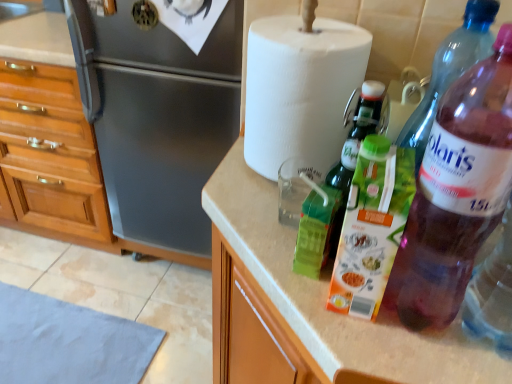
Question: Looking at their shapes, would you say beige laminate countertop at center is wider or thinner than purple translucent bottle at right, which is counted as the first bottle, starting from the back?

Choices:
 (A) wide
 (B) thin

Answer: (A)

Question: Is beige laminate countertop at center spatially inside purple translucent bottle at right, the third bottle positioned from the front, or outside of it?

Choices:
 (A) inside
 (B) outside

Answer: (B)

Question: Considering the real-world distances, which object is farthest from the brushed metal refrigerator at left?

Choices:
 (A) beige laminate countertop at center
 (B) white paper towel at upper center
 (C) purple translucent bottle at right, the third bottle positioned from the front
 (D) green matte carton at center, which appears as the second bottle when viewed from the front
 (E) translucent plastic bottle at right, the 1th bottle in the front-to-back sequence

Answer: (D)

Question: Which object is the closest to the brushed metal refrigerator at left?

Choices:
 (A) translucent plastic bottle at right, the 1th bottle in the front-to-back sequence
 (B) white paper towel at upper center
 (C) beige laminate countertop at center
 (D) green matte carton at center, which appears as the second bottle when viewed from the front
 (E) purple translucent bottle at right, the third bottle positioned from the front

Answer: (B)